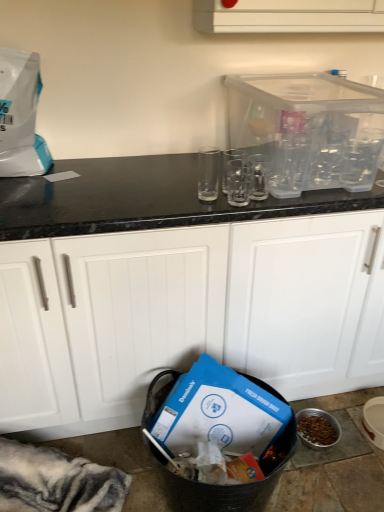
Question: Does point (345, 265) appear closer or farther from the camera than point (301, 113)?

Choices:
 (A) closer
 (B) farther

Answer: (A)

Question: Considering the positions of white matte cabinet at center and transparent plastic container at upper right in the image, is white matte cabinet at center wider or thinner than transparent plastic container at upper right?

Choices:
 (A) wide
 (B) thin

Answer: (A)

Question: Estimate the real-world distances between objects in this image. Which object is farther from the white matte cabinet at center?

Choices:
 (A) transparent glass at center, which is the first clear in left-to-right order
 (B) transparent plastic container at upper right
 (C) clear glass at center, which ranks as the 2th clear in left-to-right order
 (D) clear glass at center, which ranks as the 3th clear in left-to-right order

Answer: (A)

Question: Based on their relative distances, which object is nearer to the transparent glass at center, acting as the 3th clear starting from the right?

Choices:
 (A) clear glass at center, positioned as the second clear in right-to-left order
 (B) transparent plastic container at upper right
 (C) clear glass at center, which ranks as the 3th clear in left-to-right order
 (D) white matte cabinet at center

Answer: (A)